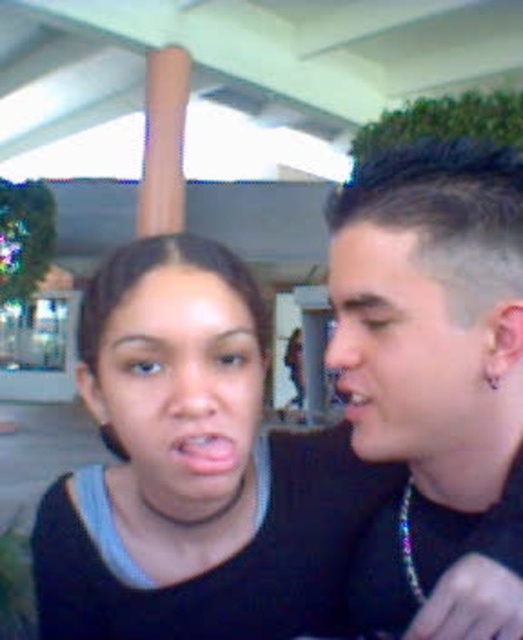
Question: From the image, what is the correct spatial relationship of pale skin face at right in relation to matte black mouth at right?

Choices:
 (A) right
 (B) left

Answer: (A)

Question: Which point is farther to the camera?

Choices:
 (A) black matte shirt at center
 (B) matte skin face at center
 (C) pink matte lips at center
 (D) pale skin face at right

Answer: (C)

Question: Which object is the farthest from the matte skin face at center?

Choices:
 (A) black matte shirt at center
 (B) matte black mouth at right

Answer: (B)

Question: Which point appears farthest from the camera in this image?

Choices:
 (A) (403, 307)
 (B) (425, 380)

Answer: (B)

Question: Observing the image, what is the correct spatial positioning of matte skin face at center in reference to pink matte lips at center?

Choices:
 (A) right
 (B) left

Answer: (B)

Question: Does black matte shirt at center have a lesser width compared to matte skin face at center?

Choices:
 (A) no
 (B) yes

Answer: (A)